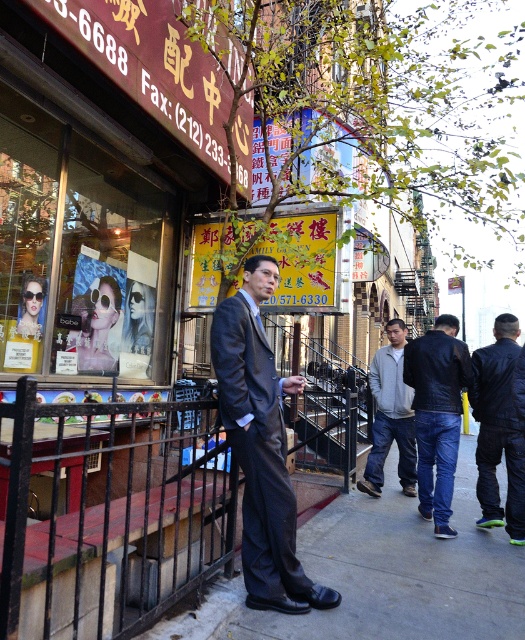
Is shiny brown suit at center to the left of gray fleece jacket at center from the viewer's perspective?

Correct, you'll find shiny brown suit at center to the left of gray fleece jacket at center.

Is point (267, 364) farther from camera compared to point (384, 410)?

No, (267, 364) is closer to viewer.

In order to click on shiny brown suit at center in this screenshot , I will do `click(260, 445)`.

Can you confirm if dark blue leather jacket at right is smaller than gray fleece jacket at center?

Yes.

Can you confirm if dark blue leather jacket at right is positioned to the right of gray fleece jacket at center?

Correct, you'll find dark blue leather jacket at right to the right of gray fleece jacket at center.

At what (x,y) coordinates should I click in order to perform the action: click on dark blue leather jacket at right. Please return your answer as a coordinate pair (x, y). The height and width of the screenshot is (640, 525). Looking at the image, I should click on (498, 429).

Between leather jacket at right and dark blue leather jacket at right, which one appears on the right side from the viewer's perspective?

From the viewer's perspective, dark blue leather jacket at right appears more on the right side.

Who is shorter, leather jacket at right or dark blue leather jacket at right?

dark blue leather jacket at right

Who is more distant from viewer, (445, 536) or (504, 344)?

Positioned behind is point (504, 344).

The height and width of the screenshot is (640, 525). Find the location of `leather jacket at right`. leather jacket at right is located at coordinates point(436,413).